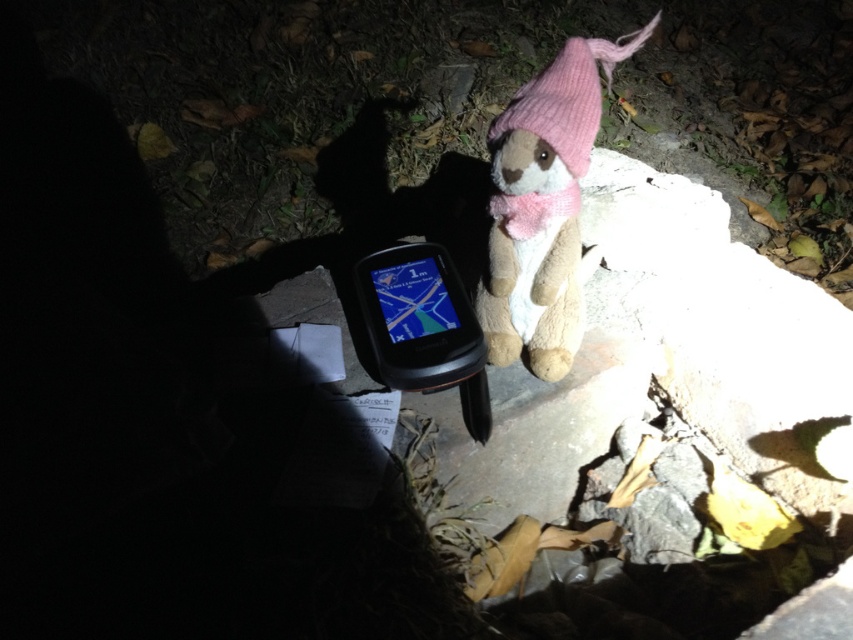
You are a hiker who has just found a GPS device next to a stuffed bear in the dark. You notice two pink knitted hats near the bear. Which hat is positioned lower, the soft pink knit hat at upper right or the pink knitted hat at upper right?

The soft pink knit hat at upper right is positioned below the pink knitted hat at upper right, so it is lower.

You are a hiker trying to navigate using the black plastic phone at center. You notice the soft pink knit hat at upper right. In which direction relative to the phone should you look to find the hat?

The soft pink knit hat at upper right is to the right of the black plastic phone at center, so you should look to the right of the phone to find the hat.

You are an adventurer holding a black plastic phone at center and a pink knitted hat at upper right. You need to place both items into a narrow pouch that can only fit items thinner than 1 cm. Which item can you place in the pouch?

The black plastic phone at center is thinner than the pink knitted hat at upper right, so you can place the black plastic phone at center into the pouch since it meets the thickness requirement.